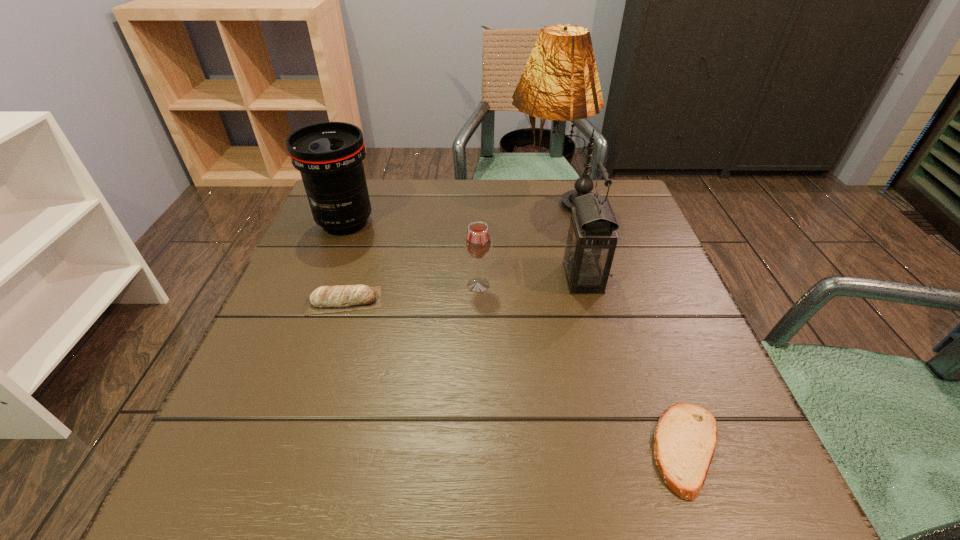
Find the location of `free space between the wineglass and the nearest object`. free space between the wineglass and the nearest object is located at coordinates (583, 367).

Image resolution: width=960 pixels, height=540 pixels. Identify the location of empty location between the lantern and the farther pita bread. (464, 289).

Locate an element on the screen. The width and height of the screenshot is (960, 540). free spot between the tallest object and the telephoto lens is located at coordinates (449, 211).

I want to click on free spot between the lantern and the telephoto lens, so click(x=464, y=250).

Where is `vacant space that is in between the third shortest object and the lantern`? The image size is (960, 540). vacant space that is in between the third shortest object and the lantern is located at coordinates (531, 281).

What are the coordinates of `empty location between the lampshade and the left pita bread` in the screenshot? It's located at (448, 251).

Find the location of a particular element. object that ranks as the second closest to the wineglass is located at coordinates pyautogui.click(x=326, y=299).

Image resolution: width=960 pixels, height=540 pixels. Identify the location of object that stands as the second closest to the farther pita bread. (478, 242).

Where is `free point that satisfies the following two spatial constraints: 1. on the front side of the right pita bread; 2. on the left side of the fourth tallest object`? free point that satisfies the following two spatial constraints: 1. on the front side of the right pita bread; 2. on the left side of the fourth tallest object is located at coordinates (478, 449).

Find the location of a particular element. blank space that satisfies the following two spatial constraints: 1. on the front-facing side of the nearest object; 2. on the right side of the tallest object is located at coordinates (609, 449).